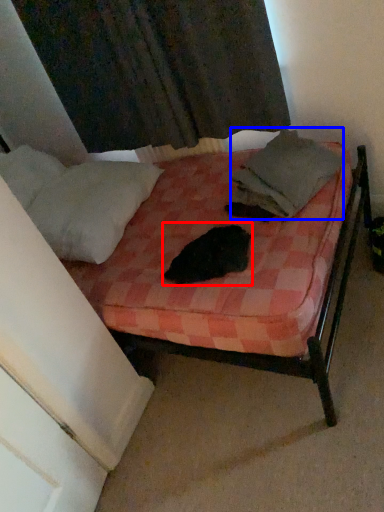
Question: Which object appears farthest to the camera in this image, animal (highlighted by a red box) or blanket (highlighted by a blue box)?

Choices:
 (A) animal
 (B) blanket

Answer: (B)